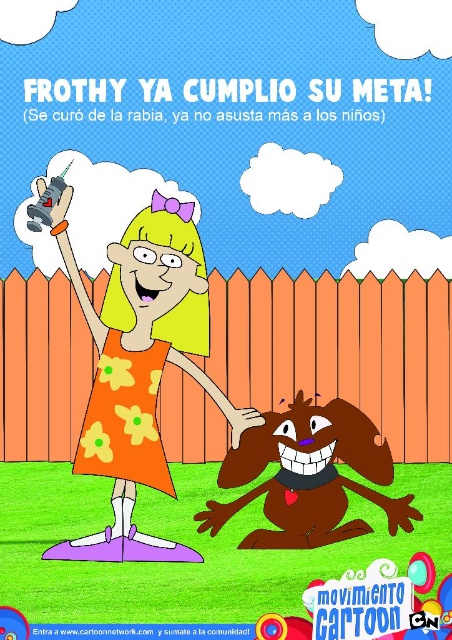
Based on the scene described, which object is larger in size between the orange floral dress at center and the brown furry dog at lower center?

The orange floral dress at center is bigger than the brown furry dog at lower center according to the description.

Consider the image. Based on the scene description, can you determine the spatial relationship between the orange floral dress at center and the brown furry dog at lower center?

The orange floral dress at center is above brown furry dog at lower center, so the dress is positioned higher up in the image compared to the dog.